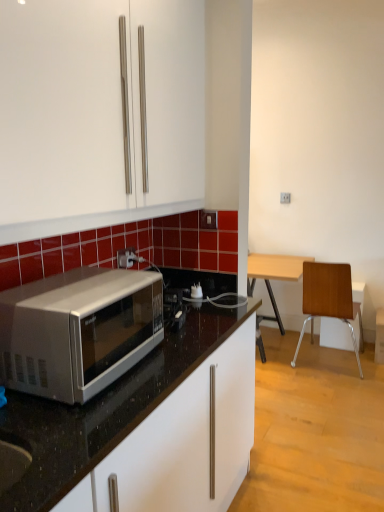
At what (x,y) coordinates should I click in order to perform the action: click on free point below wooden/metallic chair at right (from a real-world perspective). Please return your answer as a coordinate pair (x, y). This screenshot has height=512, width=384. Looking at the image, I should click on (322, 364).